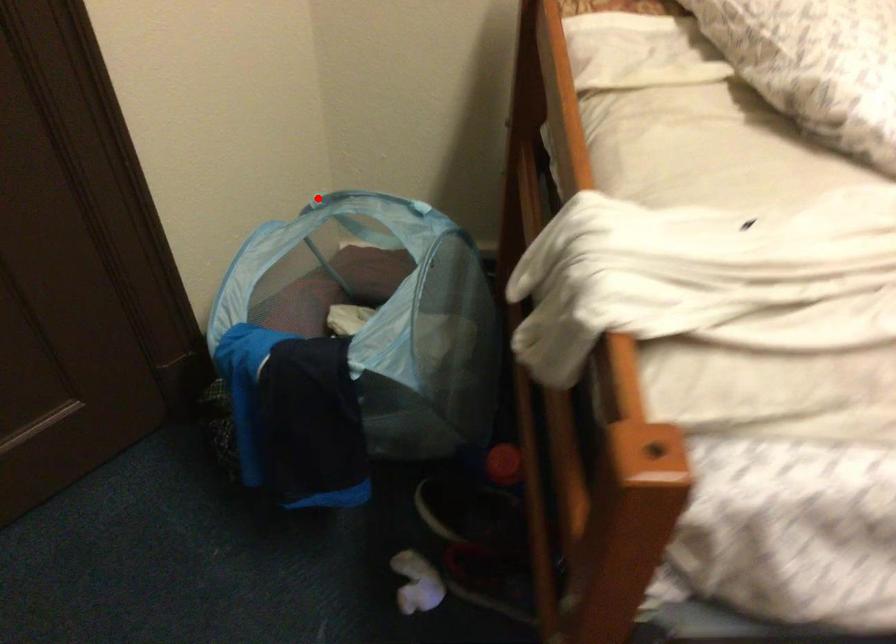
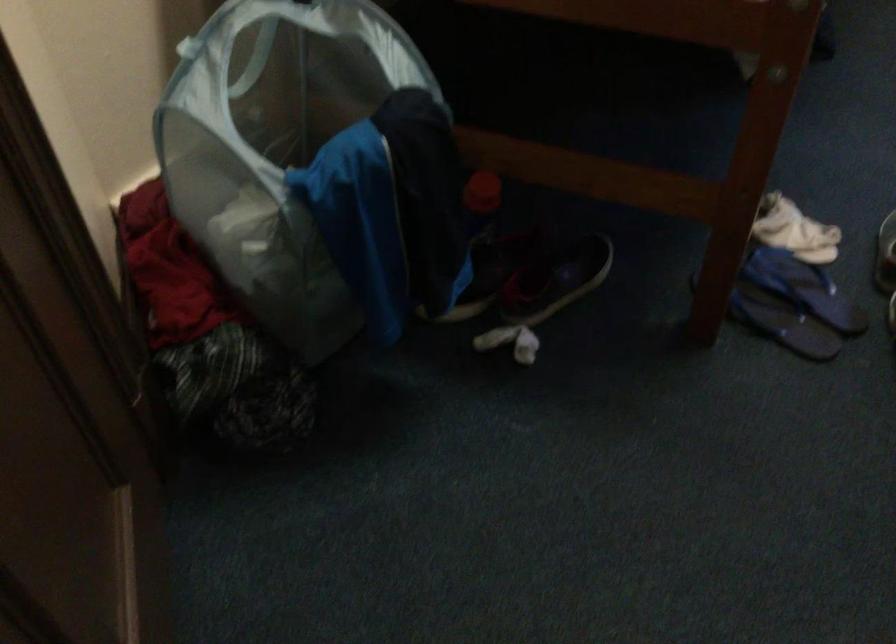
In the second image, find the point that corresponds to the highlighted location in the first image.

(186, 46)